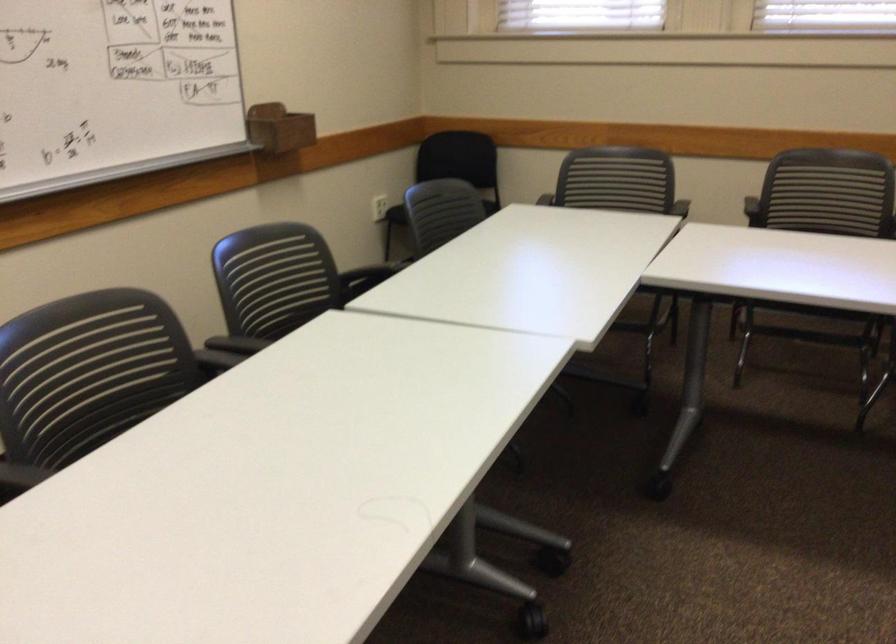
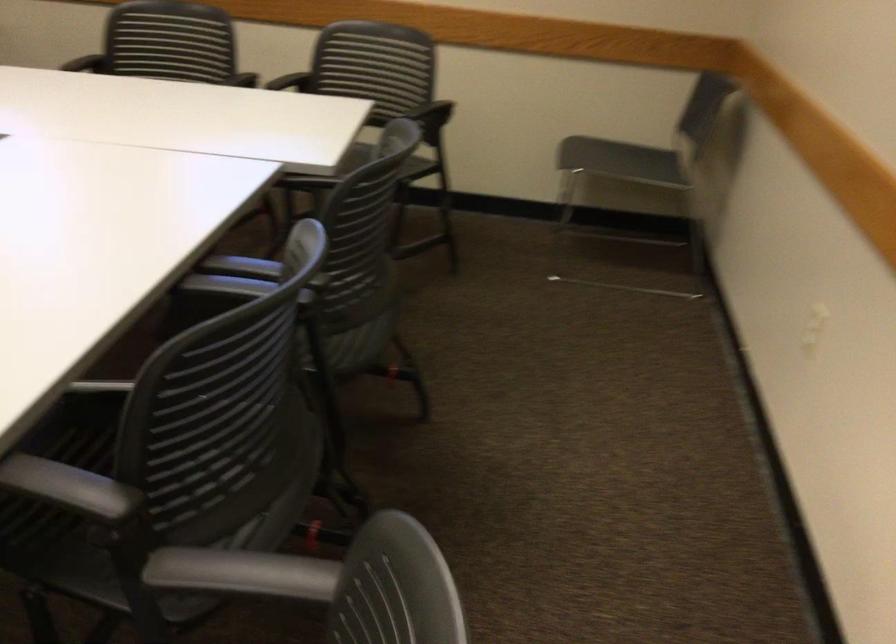
What movement of the cameraman would produce the second image?

The movement direction of the cameraman is right, backward.